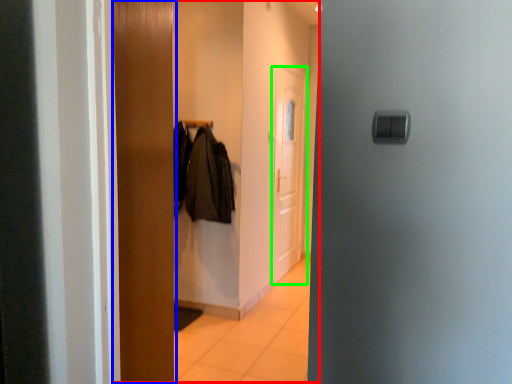
Question: Which object is positioned farthest from dresser (highlighted by a red box)? Select from door (highlighted by a blue box) and door (highlighted by a green box).

Choices:
 (A) door
 (B) door

Answer: (A)